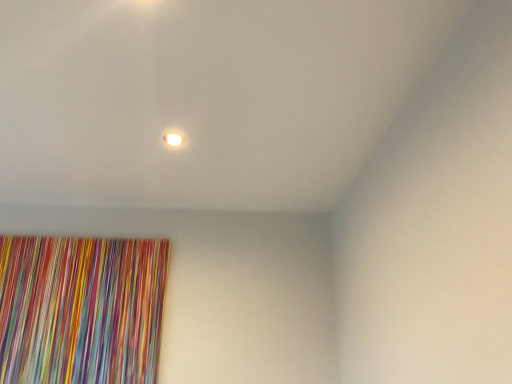
The height and width of the screenshot is (384, 512). What do you see at coordinates (173, 139) in the screenshot?
I see `white glossy light at upper center` at bounding box center [173, 139].

What is the approximate width of white glossy light at upper center?

3.59 inches.

At what (x,y) coordinates should I click in order to perform the action: click on white glossy light at upper center. Please return your answer as a coordinate pair (x, y). This screenshot has width=512, height=384. Looking at the image, I should click on (173, 139).

Identify the location of white glossy light at upper center. (173, 139).